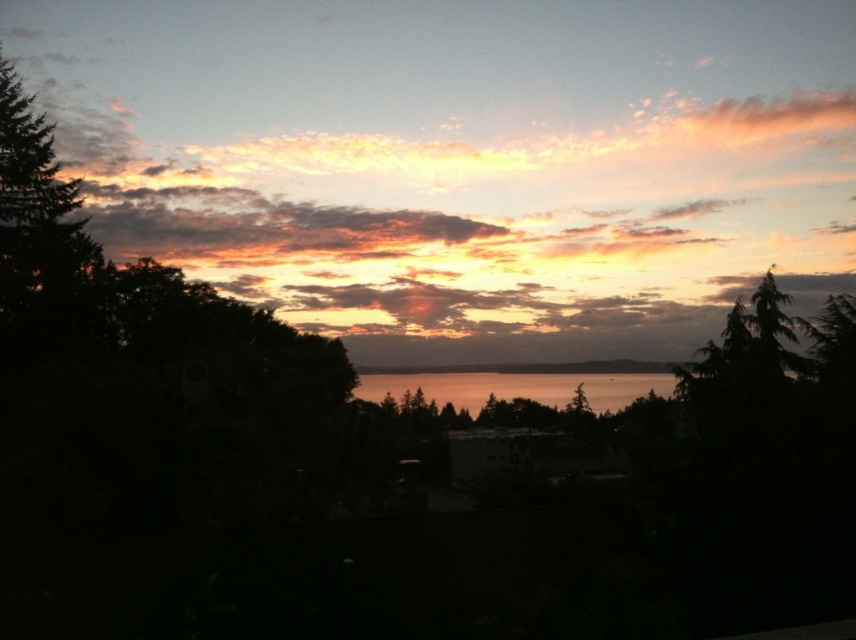
You are an artist trying to paint the sunset scene. You need to decide which area to focus on first based on their sizes. Which object is wider, the cloudy sky at upper center or the shiny metallic water at center?

The cloudy sky at upper center might be wider than the shiny metallic water at center, so you should focus on painting the cloudy sky at upper center first as it could cover a larger area.

You are standing at the water edge in the sunset scene. There is a point marked at coordinates point (548, 141). Can you walk to that point without getting wet?

The point (548, 141) is 429.60 feet away from you, so yes, you can walk to that point without getting wet as it is within a safe distance from the water edge.

You are an artist trying to paint the sunset scene. You need to decide the order of layers for the cloudy sky at upper center and the shiny metallic water at center. Which object should you paint first to ensure proper layering?

The cloudy sky at upper center is in front of the shiny metallic water at center, so you should paint the cloudy sky at upper center first, then the shiny metallic water at center to maintain the correct layering.